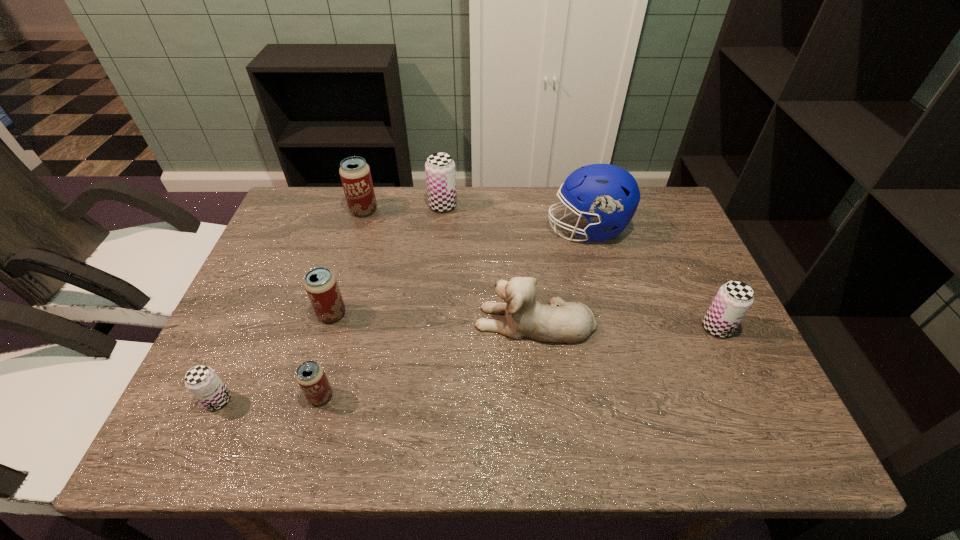
At what (x,y) coordinates should I click in order to perform the action: click on vacant space that is in between the second smallest purple beer can and the biggest purple beer can. Please return your answer as a coordinate pair (x, y). Image resolution: width=960 pixels, height=540 pixels. Looking at the image, I should click on (580, 267).

Find the location of a particular element. This screenshot has width=960, height=540. free point between the white puppy and the rightmost purple beer can is located at coordinates (626, 325).

Identify the location of vacant region between the farthest red beer can and the second farthest purple beer can. (540, 269).

Identify the location of free point between the second nearest red beer can and the football helmet. The width and height of the screenshot is (960, 540). (460, 272).

In order to click on empty location between the second farthest red beer can and the second purple beer can from left to right in this screenshot , I will do `click(388, 260)`.

This screenshot has width=960, height=540. Identify the location of blank region between the puppy and the smallest red beer can. (427, 359).

At what (x,y) coordinates should I click in order to perform the action: click on object that stands as the fourth closest to the tallest object. Please return your answer as a coordinate pair (x, y). This screenshot has height=540, width=960. Looking at the image, I should click on (355, 174).

In order to click on object that can be found as the third closest to the tallest object in this screenshot , I will do `click(440, 168)`.

Where is `beer can that is the closest to the leftmost purple beer can`? The image size is (960, 540). beer can that is the closest to the leftmost purple beer can is located at coordinates (310, 375).

You are a GUI agent. You are given a task and a screenshot of the screen. Output one action in this format:
    pyautogui.click(x=<x>, y=<y>)
    Task: Click on the beer can identified as the third closest to the smallest red beer can
    
    Given the screenshot: What is the action you would take?
    pyautogui.click(x=355, y=174)